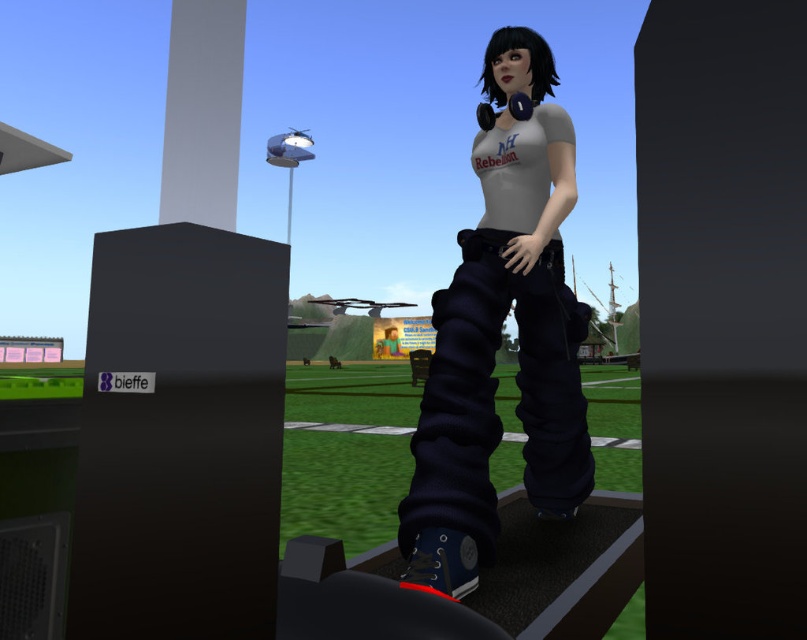
Question: Is matte white t-shirt at center above smooth gray pillar at upper left?

Choices:
 (A) no
 (B) yes

Answer: (A)

Question: Which point is closer to the camera?

Choices:
 (A) dark blue fabric football field at center
 (B) smooth gray pillar at upper left

Answer: (B)

Question: Can you confirm if matte white t-shirt at center is bigger than smooth gray pillar at upper left?

Choices:
 (A) yes
 (B) no

Answer: (A)

Question: Which point is closer to the camera taking this photo?

Choices:
 (A) (299, 428)
 (B) (546, 467)
 (C) (174, 120)

Answer: (C)

Question: Does matte white t-shirt at center appear on the left side of smooth gray pillar at upper left?

Choices:
 (A) yes
 (B) no

Answer: (B)

Question: Based on their relative distances, which object is nearer to the smooth gray pillar at upper left?

Choices:
 (A) dark blue fabric football field at center
 (B) matte white t-shirt at center

Answer: (B)